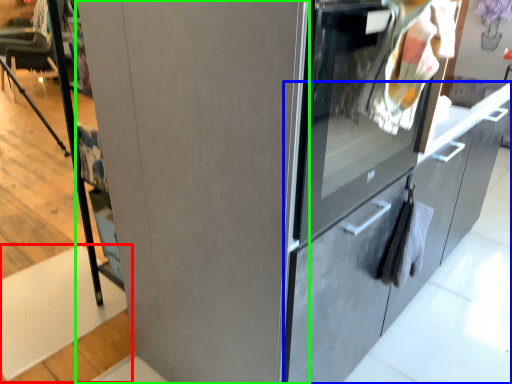
Question: Which is farther away from stair (highlighted by a red box)? cabinetry (highlighted by a blue box) or door (highlighted by a green box)?

Choices:
 (A) cabinetry
 (B) door

Answer: (A)